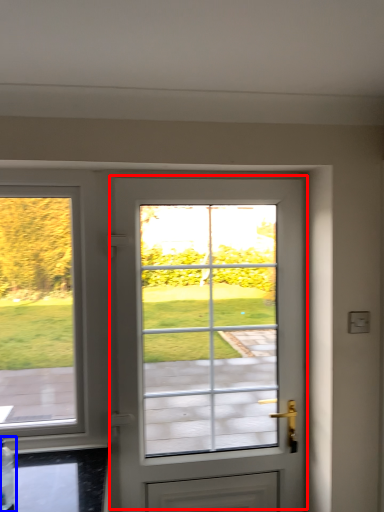
Question: Among these objects, which one is nearest to the camera, door (highlighted by a red box) or bottle (highlighted by a blue box)?

Choices:
 (A) door
 (B) bottle

Answer: (B)